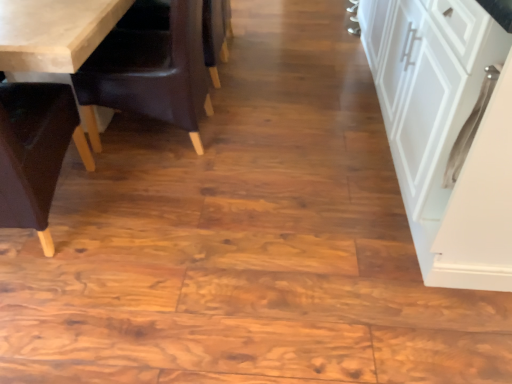
What do you see at coordinates (149, 68) in the screenshot?
I see `brown leather chair at left, placed as the second chair when sorted from left to right` at bounding box center [149, 68].

Locate an element on the screen. white matte cabinet at right is located at coordinates (446, 133).

Is brown leather chair at left, placed as the 1th chair when sorted from right to left, positioned with its back to wooden chair at left, the 2th chair positioned from the right?

No.

From a real-world perspective, who is located higher, brown leather chair at left, placed as the second chair when sorted from left to right, or wooden chair at left, the 2th chair positioned from the right?

wooden chair at left, the 2th chair positioned from the right.

Based on their positions, is brown leather chair at left, placed as the second chair when sorted from left to right, located to the left or right of wooden chair at left, the 2th chair positioned from the right?

In the image, brown leather chair at left, placed as the second chair when sorted from left to right, appears on the right side of wooden chair at left, the 2th chair positioned from the right.

Is dark brown leather armchair at center inside wooden chair at left, the 2th chair positioned from the right?

Actually, dark brown leather armchair at center is outside wooden chair at left, the 2th chair positioned from the right.

Consider the image. Is wooden chair at left, the first chair when ordered from left to right, in front of or behind dark brown leather armchair at center in the image?

Clearly, wooden chair at left, the first chair when ordered from left to right, is in front of dark brown leather armchair at center.

From a real-world perspective, is wooden chair at left, the first chair when ordered from left to right, below dark brown leather armchair at center?

Incorrect, from a real-world perspective, wooden chair at left, the first chair when ordered from left to right, is higher than dark brown leather armchair at center.

Is point (54, 85) farther from camera compared to point (132, 18)?

That is False.

From a real-world perspective, which is physically below, brown leather chair at left, placed as the second chair when sorted from left to right, or white matte cabinet at right?

brown leather chair at left, placed as the second chair when sorted from left to right, is physically lower.

Could you tell me if brown leather chair at left, placed as the second chair when sorted from left to right, is turned towards white matte cabinet at right?

No, brown leather chair at left, placed as the second chair when sorted from left to right, is not aimed at white matte cabinet at right.

Who is smaller, brown leather chair at left, placed as the second chair when sorted from left to right, or white matte cabinet at right?

brown leather chair at left, placed as the second chair when sorted from left to right.

Is brown leather chair at left, placed as the 1th chair when sorted from right to left, touching white matte cabinet at right?

brown leather chair at left, placed as the 1th chair when sorted from right to left, and white matte cabinet at right are not in contact.

Identify the location of cabinetry in front of the wooden chair at left, the first chair when ordered from left to right. The image size is (512, 384). (446, 133).

Is wooden chair at left, the first chair when ordered from left to right, completely or partially outside of white matte cabinet at right?

Yes.

How many degrees apart are the facing directions of wooden chair at left, the first chair when ordered from left to right, and white matte cabinet at right?

85.7 degrees.

From a real-world perspective, which is physically above, wooden chair at left, the 2th chair positioned from the right, or white matte cabinet at right?

In real-world perspective, white matte cabinet at right is above.

From the image's perspective, who appears lower, dark brown leather armchair at center or brown leather chair at left, placed as the second chair when sorted from left to right?

brown leather chair at left, placed as the second chair when sorted from left to right, is shown below in the image.

In the scene shown: Can you see dark brown leather armchair at center touching brown leather chair at left, placed as the second chair when sorted from left to right?

dark brown leather armchair at center and brown leather chair at left, placed as the second chair when sorted from left to right, are clearly separated.

In the scene shown: Is dark brown leather armchair at center facing away from brown leather chair at left, placed as the 1th chair when sorted from right to left?

No, dark brown leather armchair at center's orientation is not away from brown leather chair at left, placed as the 1th chair when sorted from right to left.

Is point (158, 12) positioned before point (158, 86)?

No.

How different are the orientations of brown leather chair at left, placed as the second chair when sorted from left to right, and dark brown leather armchair at center in degrees?

The facing directions of brown leather chair at left, placed as the second chair when sorted from left to right, and dark brown leather armchair at center are 0.000263 degrees apart.

Does brown leather chair at left, placed as the second chair when sorted from left to right, turn towards dark brown leather armchair at center?

No, brown leather chair at left, placed as the second chair when sorted from left to right, is not oriented towards dark brown leather armchair at center.

From the image's perspective, is brown leather chair at left, placed as the second chair when sorted from left to right, below dark brown leather armchair at center?

Indeed, from the image's perspective, brown leather chair at left, placed as the second chair when sorted from left to right, is shown beneath dark brown leather armchair at center.

Locate an element on the screen. the 1st chair counting from the left side of the dark brown leather armchair at center is located at coordinates (149, 68).

Considering the positions of objects dark brown leather armchair at center and white matte cabinet at right in the image provided, who is more to the left, dark brown leather armchair at center or white matte cabinet at right?

Positioned to the left is dark brown leather armchair at center.

How many degrees apart are the facing directions of dark brown leather armchair at center and white matte cabinet at right?

There is a 0.659-degree angle between the facing directions of dark brown leather armchair at center and white matte cabinet at right.

Is dark brown leather armchair at center spatially inside white matte cabinet at right, or outside of it?

dark brown leather armchair at center is outside white matte cabinet at right.

Is dark brown leather armchair at center facing towards white matte cabinet at right?

No, dark brown leather armchair at center is not facing towards white matte cabinet at right.

Image resolution: width=512 pixels, height=384 pixels. Find the location of `chair in front of the brown leather chair at left, placed as the second chair when sorted from left to right`. chair in front of the brown leather chair at left, placed as the second chair when sorted from left to right is located at coordinates (35, 152).

At what (x,y) coordinates should I click in order to perform the action: click on chair that is the 2nd one above the dark brown leather armchair at center (from a real-world perspective). Please return your answer as a coordinate pair (x, y). Image resolution: width=512 pixels, height=384 pixels. Looking at the image, I should click on (35, 152).

Considering their positions, is wooden chair at left, the first chair when ordered from left to right, positioned further to brown leather chair at left, placed as the second chair when sorted from left to right, than white matte cabinet at right?

white matte cabinet at right.

When comparing their distances from dark brown leather armchair at center, does white matte cabinet at right or brown leather chair at left, placed as the 1th chair when sorted from right to left, seem further?

white matte cabinet at right is positioned further to the anchor dark brown leather armchair at center.

Which object lies further to the anchor point dark brown leather armchair at center, wooden chair at left, the 2th chair positioned from the right, or white matte cabinet at right?

white matte cabinet at right is further to dark brown leather armchair at center.

Estimate the real-world distances between objects in this image. Which object is closer to white matte cabinet at right, dark brown leather armchair at center or wooden chair at left, the first chair when ordered from left to right?

dark brown leather armchair at center is closer to white matte cabinet at right.

Looking at the image, which one is located further to wooden chair at left, the first chair when ordered from left to right, brown leather chair at left, placed as the 1th chair when sorted from right to left, or dark brown leather armchair at center?

dark brown leather armchair at center lies further to wooden chair at left, the first chair when ordered from left to right, than the other object.

Estimate the real-world distances between objects in this image. Which object is closer to dark brown leather armchair at center, brown leather chair at left, placed as the second chair when sorted from left to right, or wooden chair at left, the 2th chair positioned from the right?

brown leather chair at left, placed as the second chair when sorted from left to right, is closer to dark brown leather armchair at center.

From the image, which object appears to be farther from wooden chair at left, the first chair when ordered from left to right, brown leather chair at left, placed as the second chair when sorted from left to right, or white matte cabinet at right?

white matte cabinet at right is positioned further to the anchor wooden chair at left, the first chair when ordered from left to right.

Looking at the image, which one is located further to brown leather chair at left, placed as the second chair when sorted from left to right, dark brown leather armchair at center or wooden chair at left, the 2th chair positioned from the right?

wooden chair at left, the 2th chair positioned from the right, lies further to brown leather chair at left, placed as the second chair when sorted from left to right, than the other object.

Locate an element on the screen. Image resolution: width=512 pixels, height=384 pixels. armchair between wooden chair at left, the first chair when ordered from left to right, and white matte cabinet at right, in the horizontal direction is located at coordinates [215, 35].

Where is `chair between wooden chair at left, the 2th chair positioned from the right, and white matte cabinet at right from left to right`? The width and height of the screenshot is (512, 384). chair between wooden chair at left, the 2th chair positioned from the right, and white matte cabinet at right from left to right is located at coordinates (149, 68).

Identify the location of armchair situated between brown leather chair at left, placed as the second chair when sorted from left to right, and white matte cabinet at right from left to right. (215, 35).

Find the location of a particular element. chair located between wooden chair at left, the 2th chair positioned from the right, and dark brown leather armchair at center in the depth direction is located at coordinates (149, 68).